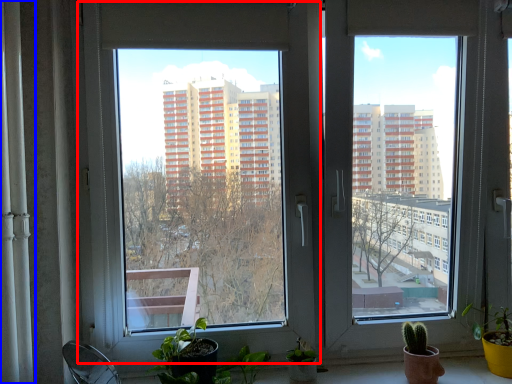
Question: Which object is closer to the camera taking this photo, window (highlighted by a red box) or curtain (highlighted by a blue box)?

Choices:
 (A) window
 (B) curtain

Answer: (B)